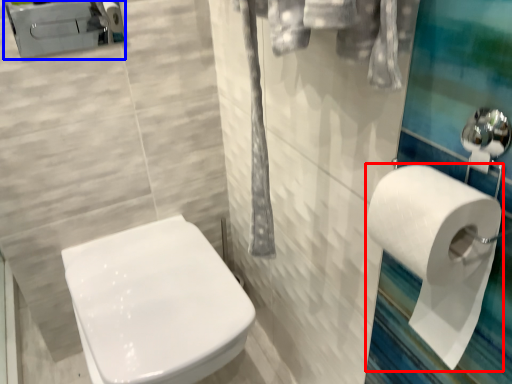
Question: Which point is further to the camera, toilet paper (highlighted by a red box) or porcelain (highlighted by a blue box)?

Choices:
 (A) toilet paper
 (B) porcelain

Answer: (B)